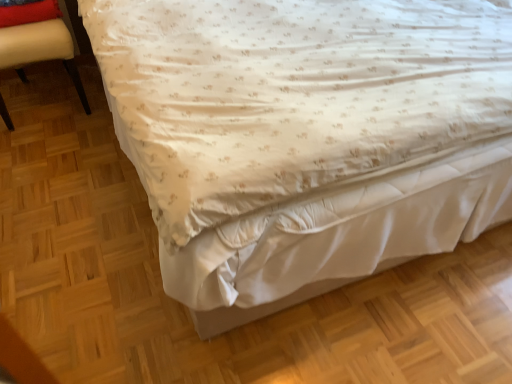
Question: Does point (55, 26) appear closer or farther from the camera than point (12, 21)?

Choices:
 (A) closer
 (B) farther

Answer: (B)

Question: In terms of width, does beige leather chair at left look wider or thinner when compared to red velvet pillow at upper left?

Choices:
 (A) thin
 (B) wide

Answer: (B)

Question: Choose the correct answer: Is beige leather chair at left inside red velvet pillow at upper left or outside it?

Choices:
 (A) inside
 (B) outside

Answer: (B)

Question: From the image's perspective, is red velvet pillow at upper left located above or below beige leather chair at left?

Choices:
 (A) below
 (B) above

Answer: (B)

Question: Is red velvet pillow at upper left to the left or to the right of beige leather chair at left in the image?

Choices:
 (A) left
 (B) right

Answer: (B)

Question: Do you think red velvet pillow at upper left is within beige leather chair at left, or outside of it?

Choices:
 (A) inside
 (B) outside

Answer: (A)

Question: In terms of height, does red velvet pillow at upper left look taller or shorter compared to beige leather chair at left?

Choices:
 (A) tall
 (B) short

Answer: (B)